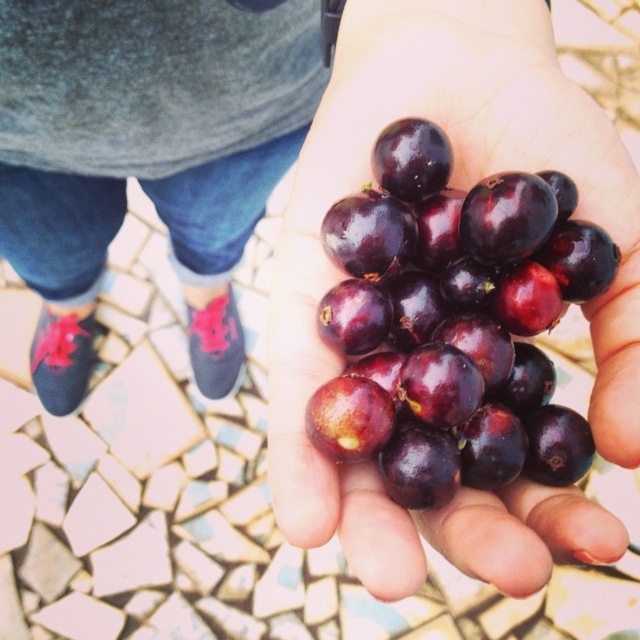
You are trying to locate the exact position of the point marked at coordinates (x=461, y=188) in the image. Based on the scene description, where would this point be located?

The point at coordinates (x=461, y=188) is located on the shiny dark purple grapes at center.

You are a photographer trying to capture the shiny dark purple grapes at center and the matte black shoes at lower left in the same frame. Based on their positions, which object should you adjust your camera angle upwards to include in the shot?

Since the shiny dark purple grapes at center is not as tall as the matte black shoes at lower left, you should adjust your camera angle upwards to include the shiny dark purple grapes at center in the shot.

Consider the image. You are a photographer trying to capture a close up of the shiny dark purple grapes at center. The camera you are using requires the subject to be at least 15 inches away to focus properly. Based on the scene, will the grapes be in focus?

The shiny dark purple grapes at center is 14.89 inches away from camera, which is less than the required 15 inches. Therefore, the grapes will not be in focus.